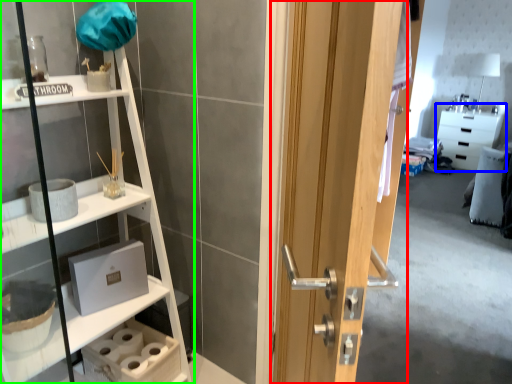
Question: Which is farther away from door (highlighted by a red box)? cabinetry (highlighted by a blue box) or shelf (highlighted by a green box)?

Choices:
 (A) cabinetry
 (B) shelf

Answer: (A)